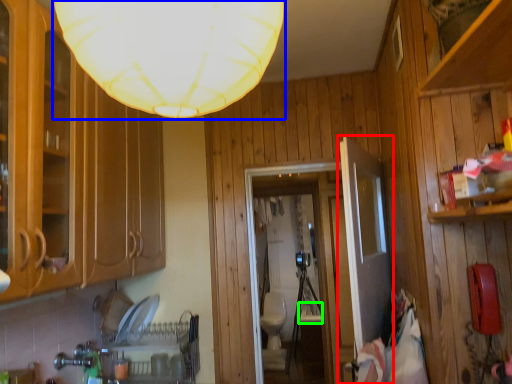
Question: Which object is positioned farthest from door (highlighted by a red box)? Select from lamp (highlighted by a blue box) and sink (highlighted by a green box).

Choices:
 (A) lamp
 (B) sink

Answer: (B)